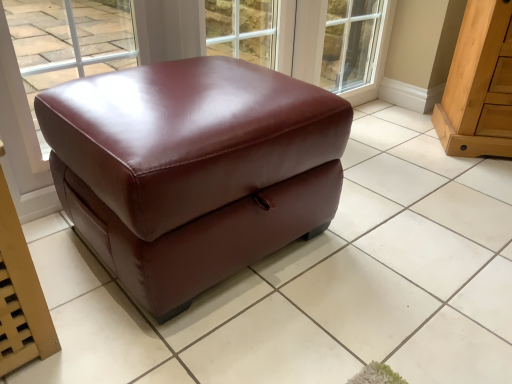
Locate an element on the screen. This screenshot has height=384, width=512. free location in front of light brown wood drawer at right, which appears as the second furniture when viewed from the left is located at coordinates (476, 176).